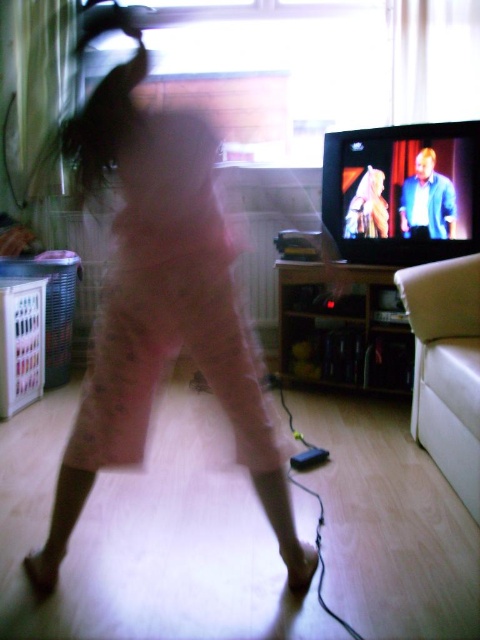
You are a fashion designer who wants to create a new line of skirts. You see the pink fabric skirt at center and the matte plastic tv at upper right in the image. Which object has a greater width?

The pink fabric skirt at center has a greater width than the matte plastic tv at upper right.

You are a photographer trying to capture a clear photo of the pink fabric skirt at center and the matte plastic tv at upper right. Since the scene is motion blurred, which object should you focus on to get a clearer image?

The pink fabric skirt at center is positioned on the left side of matte plastic tv at upper right, so focusing on the pink fabric skirt at center would be better as it is closer to the photographer.

You are a photographer trying to capture a clear shot of the pink fabric skirt at center and the matte plastic tv at upper right. Since the scene is motion blurred, which object should you focus on to get a clearer image?

The pink fabric skirt at center is in front of the matte plastic tv at upper right, so focusing on the pink fabric skirt at center would likely result in a clearer image due to its closer proximity to the camera.